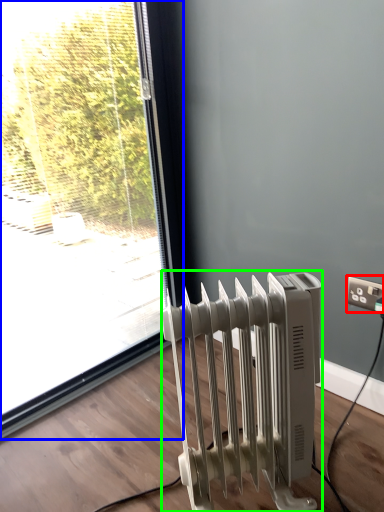
Question: Based on their relative distances, which object is nearer to electric outlet (highlighted by a red box)? Choose from window (highlighted by a blue box) and radiator (highlighted by a green box).

Choices:
 (A) window
 (B) radiator

Answer: (B)